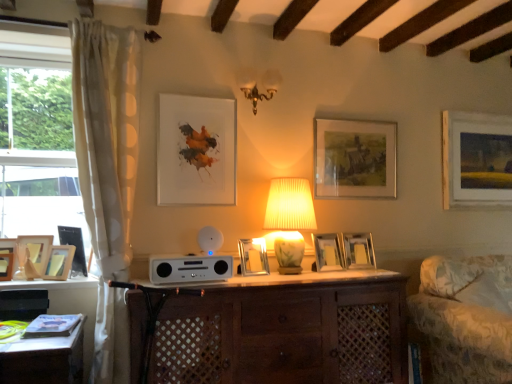
Question: Is there a large distance between wooden picture frame at left, placed as the 8th picture frame when sorted from right to left, and wooden picture frame at left, which is the first picture frame from left to right?

Choices:
 (A) no
 (B) yes

Answer: (A)

Question: Does wooden picture frame at left, placed as the 8th picture frame when sorted from right to left, appear on the right side of wooden picture frame at left, which is the first picture frame from left to right?

Choices:
 (A) no
 (B) yes

Answer: (B)

Question: Does wooden picture frame at left, acting as the third picture frame starting from the left, have a lesser height compared to wooden picture frame at left, which is the first picture frame from left to right?

Choices:
 (A) yes
 (B) no

Answer: (A)

Question: From the image's perspective, is wooden picture frame at left, placed as the 8th picture frame when sorted from right to left, below wooden picture frame at left, the 10th picture frame from the right?

Choices:
 (A) yes
 (B) no

Answer: (B)

Question: Does wooden picture frame at left, acting as the third picture frame starting from the left, lie behind wooden picture frame at left, the 10th picture frame from the right?

Choices:
 (A) no
 (B) yes

Answer: (B)

Question: Considering the relative positions of white glossy stereo at center and metallic silver picture frame at center, which is the 8th picture frame from left to right, in the image provided, is white glossy stereo at center to the left or to the right of metallic silver picture frame at center, which is the 8th picture frame from left to right,?

Choices:
 (A) left
 (B) right

Answer: (A)

Question: From the image's perspective, is white glossy stereo at center located above or below metallic silver picture frame at center, positioned as the third picture frame in right-to-left order?

Choices:
 (A) above
 (B) below

Answer: (B)

Question: From their relative heights in the image, would you say white glossy stereo at center is taller or shorter than metallic silver picture frame at center, positioned as the third picture frame in right-to-left order?

Choices:
 (A) tall
 (B) short

Answer: (B)

Question: Is white glossy stereo at center in front of or behind metallic silver picture frame at center, which is the 8th picture frame from left to right, in the image?

Choices:
 (A) behind
 (B) front

Answer: (B)

Question: From the image's perspective, is silver metallic picture frame at center, the sixth picture frame positioned from the left, located above or below patterned fabric swivel chair at right?

Choices:
 (A) below
 (B) above

Answer: (B)

Question: Is silver metallic picture frame at center, the sixth picture frame positioned from the left, situated inside patterned fabric swivel chair at right or outside?

Choices:
 (A) inside
 (B) outside

Answer: (B)

Question: In terms of height, does silver metallic picture frame at center, the fifth picture frame in the right-to-left sequence, look taller or shorter compared to patterned fabric swivel chair at right?

Choices:
 (A) short
 (B) tall

Answer: (A)

Question: Considering their positions, is silver metallic picture frame at center, the sixth picture frame positioned from the left, located in front of or behind patterned fabric swivel chair at right?

Choices:
 (A) front
 (B) behind

Answer: (B)

Question: In the image, is metallic silver picture frame at center, the 7th picture frame positioned from the left, positioned in front of or behind white glossy stereo at center?

Choices:
 (A) front
 (B) behind

Answer: (B)

Question: From a real-world perspective, is metallic silver picture frame at center, arranged as the 4th picture frame when viewed from the right, positioned above or below white glossy stereo at center?

Choices:
 (A) above
 (B) below

Answer: (A)